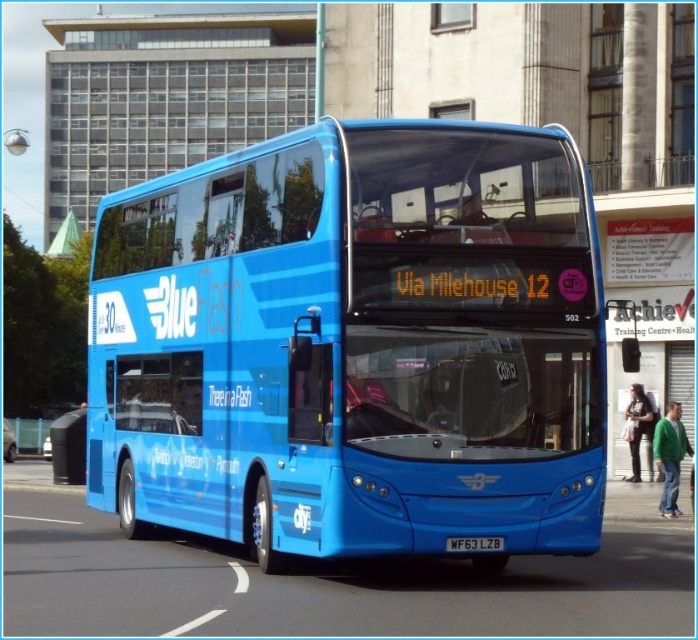
Does blue glossy bus at center have a greater height compared to white plastic license plate at center?

Correct, blue glossy bus at center is much taller as white plastic license plate at center.

Which is behind, point (385, 337) or point (456, 547)?

Point (456, 547)

Does point (131, 244) lie in front of point (482, 545)?

No, (131, 244) is behind (482, 545).

You are a GUI agent. You are given a task and a screenshot of the screen. Output one action in this format:
    pyautogui.click(x=<x>, y=<y>)
    Task: Click on the blue glossy bus at center
    
    Given the screenshot: What is the action you would take?
    pyautogui.click(x=355, y=344)

Between matte black trash can at lower left and white plastic license plate at center, which one has less height?

white plastic license plate at center

At what (x,y) coordinates should I click in order to perform the action: click on matte black trash can at lower left. Please return your answer as a coordinate pair (x, y). Looking at the image, I should click on (68, 445).

Is blue glossy bus at center thinner than matte black trash can at lower left?

No.

Does blue glossy bus at center appear over matte black trash can at lower left?

Yes.

Which is in front, point (600, 449) or point (57, 458)?

Point (600, 449)

The height and width of the screenshot is (640, 698). Identify the location of blue glossy bus at center. (355, 344).